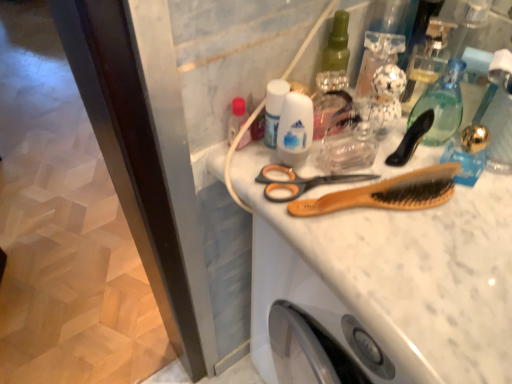
Locate an element on the screen. The width and height of the screenshot is (512, 384). vacant region to the right of white matte deodorant at center, the 2th toiletry in the left-to-right sequence is located at coordinates (423, 199).